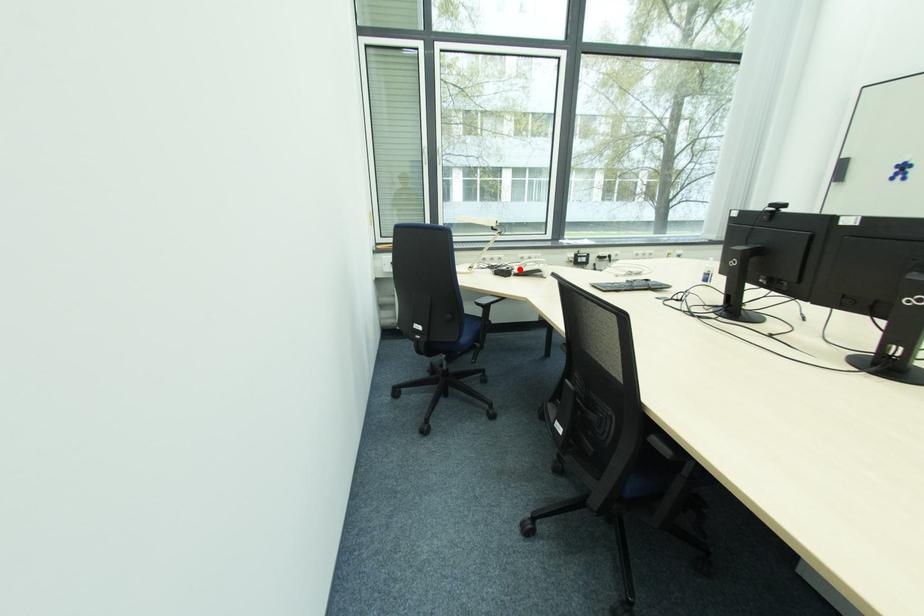
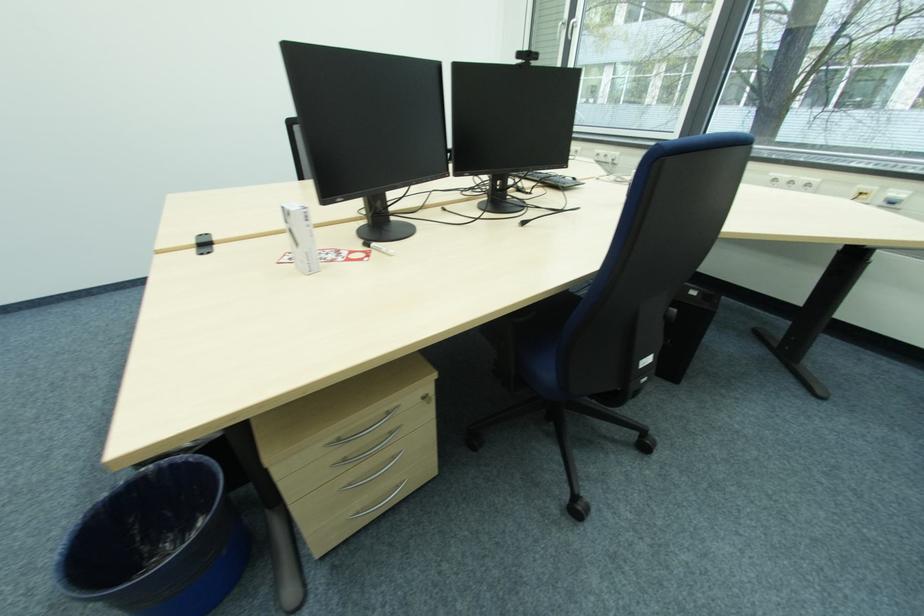
Question: I am providing you with two images of the same scene from different viewpoints. A red point is marked on the first image. Can you still see the location of the red point in image 2?

Choices:
 (A) Yes
 (B) No

Answer: (B)